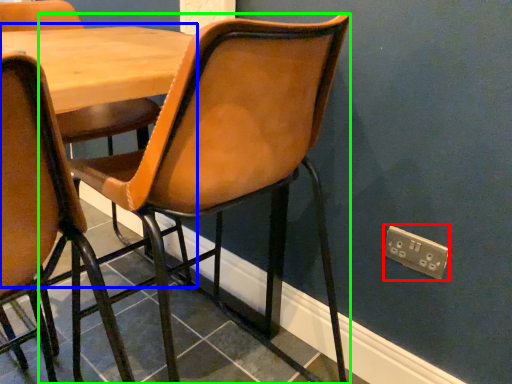
Question: Based on their relative distances, which object is nearer to electric outlet (highlighted by a red box)? Choose from table (highlighted by a blue box) and chair (highlighted by a green box).

Choices:
 (A) table
 (B) chair

Answer: (B)